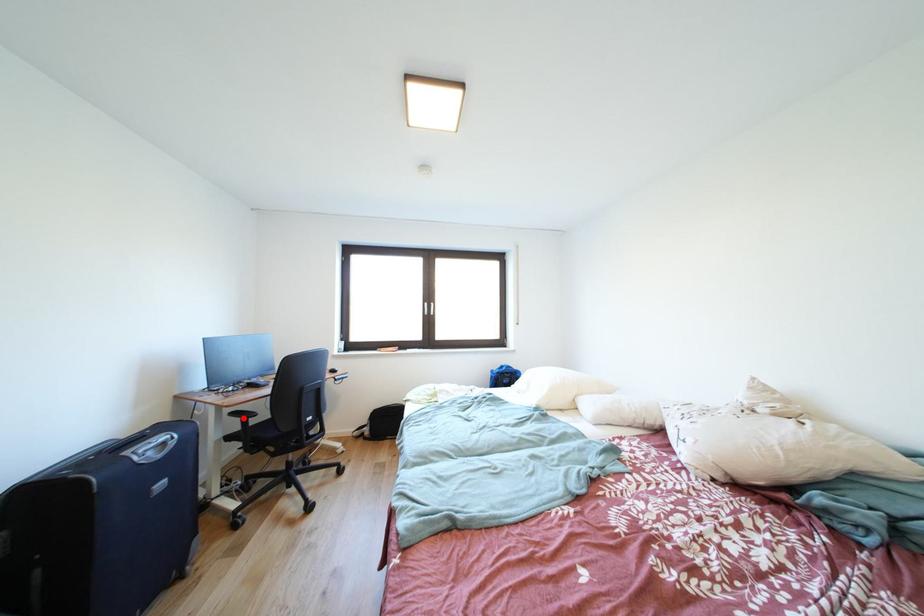
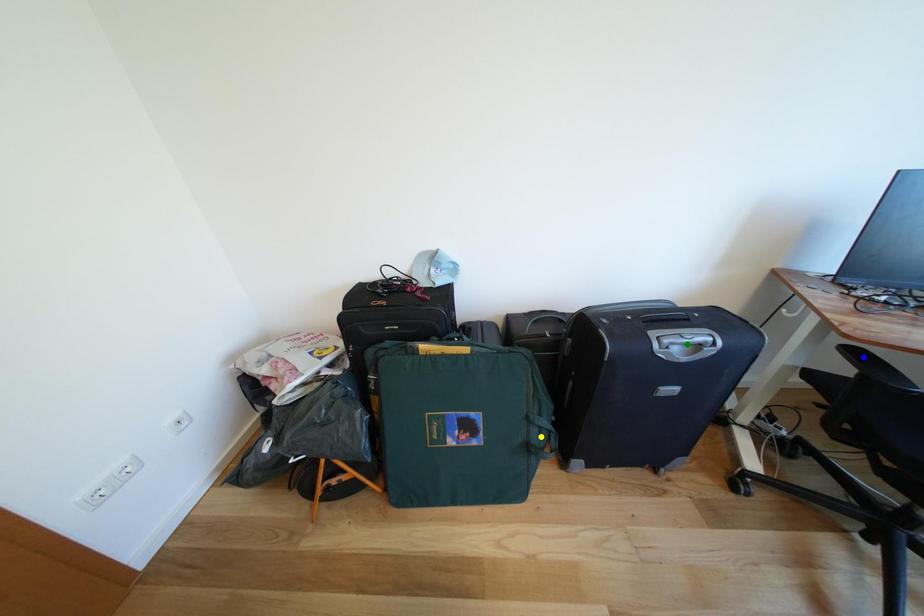
Question: I am providing you with two images of the same scene from different viewpoints. A red point is marked on the first image. You are given multiple points on the second image. Which point in image 2 represents the same 3d spot as the red point in image 1?

Choices:
 (A) green point
 (B) blue point
 (C) yellow point

Answer: (B)